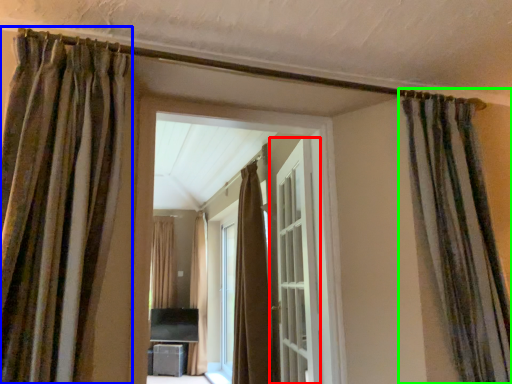
Question: Estimate the real-world distances between objects in this image. Which object is farther from door (highlighted by a red box), curtain (highlighted by a blue box) or curtain (highlighted by a green box)?

Choices:
 (A) curtain
 (B) curtain

Answer: (A)